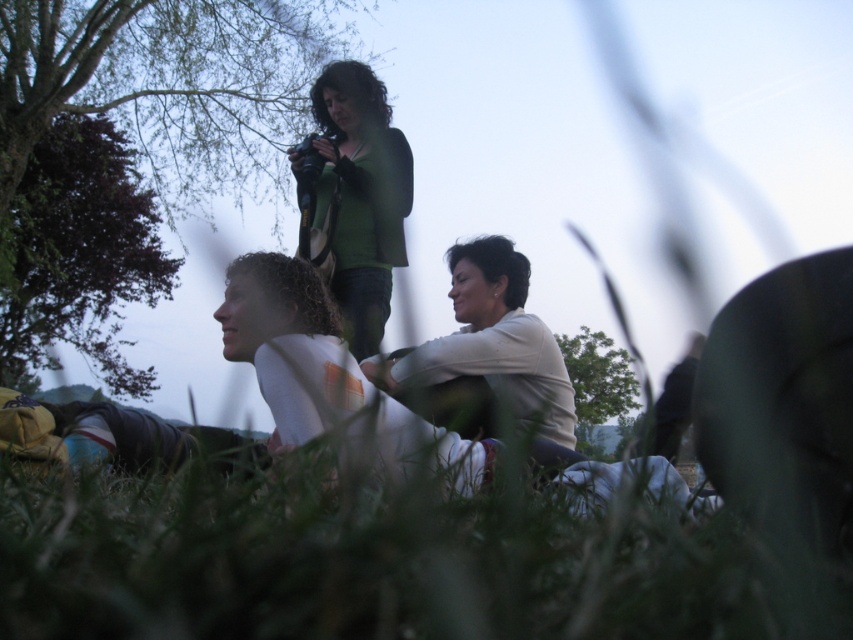
Question: Can you confirm if green leafy tree at upper left is positioned to the right of white cotton shirt at center?

Choices:
 (A) no
 (B) yes

Answer: (A)

Question: Which of the following is the closest to the observer?

Choices:
 (A) (78, 180)
 (B) (358, 280)

Answer: (B)

Question: Which point appears farthest from the camera in this image?

Choices:
 (A) (419, 611)
 (B) (164, 204)
 (C) (389, 406)

Answer: (B)

Question: Does green grass at lower center come behind white cotton shirt at center?

Choices:
 (A) yes
 (B) no

Answer: (B)

Question: Which point is closer to the camera?

Choices:
 (A) dark green leaves at upper left
 (B) green leafy tree at upper left

Answer: (A)

Question: Does white cotton shirt at center appear on the left side of green leafy tree at center?

Choices:
 (A) no
 (B) yes

Answer: (B)